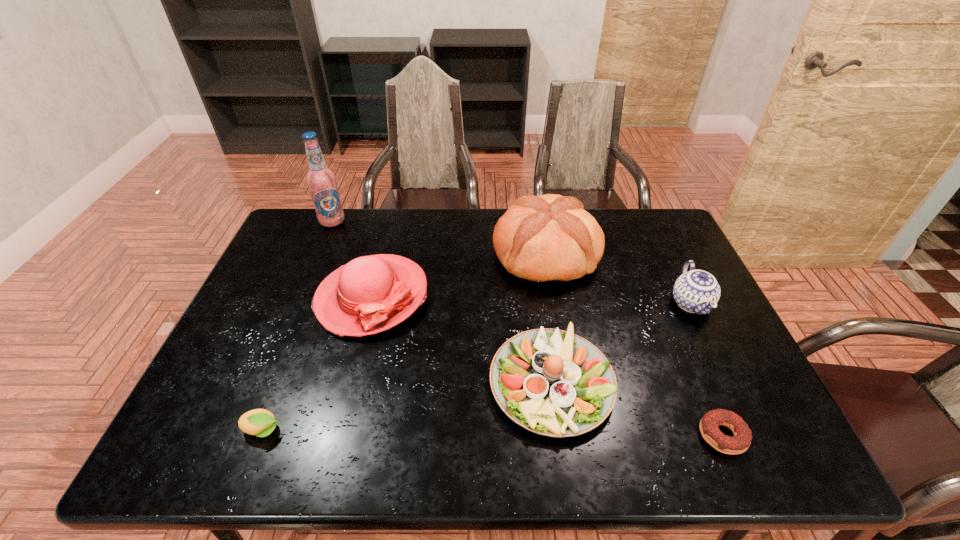
Identify which object is the fourth nearest to the third shortest object. Please provide its 2D coordinates. Your answer should be formatted as a tuple, i.e. [(x, y)], where the tuple contains the x and y coordinates of a point satisfying the conditions above.

[(696, 291)]

Identify which object is the second closest to the second tallest object. Please provide its 2D coordinates. Your answer should be formatted as a tuple, i.e. [(x, y)], where the tuple contains the x and y coordinates of a point satisfying the conditions above.

[(696, 291)]

Identify the location of free space that satisfies the following two spatial constraints: 1. on the back side of the doughnut; 2. with leaves positioned above the lemon. The height and width of the screenshot is (540, 960). (720, 430).

Where is `free location that satisfies the following two spatial constraints: 1. at the front of the hat with a bow; 2. on the left side of the fifth tallest object`? This screenshot has height=540, width=960. free location that satisfies the following two spatial constraints: 1. at the front of the hat with a bow; 2. on the left side of the fifth tallest object is located at coordinates (350, 381).

You are a GUI agent. You are given a task and a screenshot of the screen. Output one action in this format:
    pyautogui.click(x=<x>, y=<y>)
    Task: Click on the free space that satisfies the following two spatial constraints: 1. at the front of the hat with a bow; 2. with leaves positioned above the second shortest object
    The image size is (960, 540).
    Given the screenshot: What is the action you would take?
    pyautogui.click(x=339, y=430)

You are a GUI agent. You are given a task and a screenshot of the screen. Output one action in this format:
    pyautogui.click(x=<x>, y=<y>)
    Task: Click on the vacant area in the image that satisfies the following two spatial constraints: 1. at the spout of the chinaware; 2. with leaves positioned above the sixth tallest object
    The height and width of the screenshot is (540, 960).
    Given the screenshot: What is the action you would take?
    [752, 430]

What are the coordinates of `free space that satisfies the following two spatial constraints: 1. on the front side of the shortest object; 2. on the right side of the alcohol` in the screenshot? It's located at (244, 435).